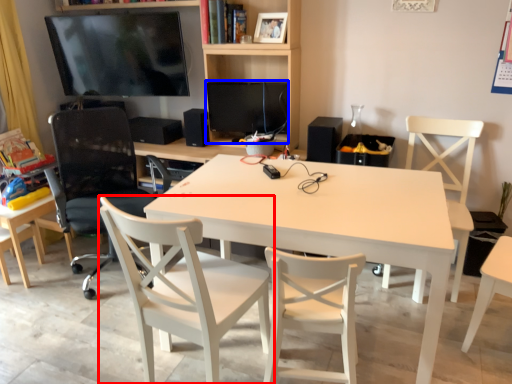
Question: Which of the following is the farthest to the observer, chair (highlighted by a red box) or computer monitor (highlighted by a blue box)?

Choices:
 (A) chair
 (B) computer monitor

Answer: (B)